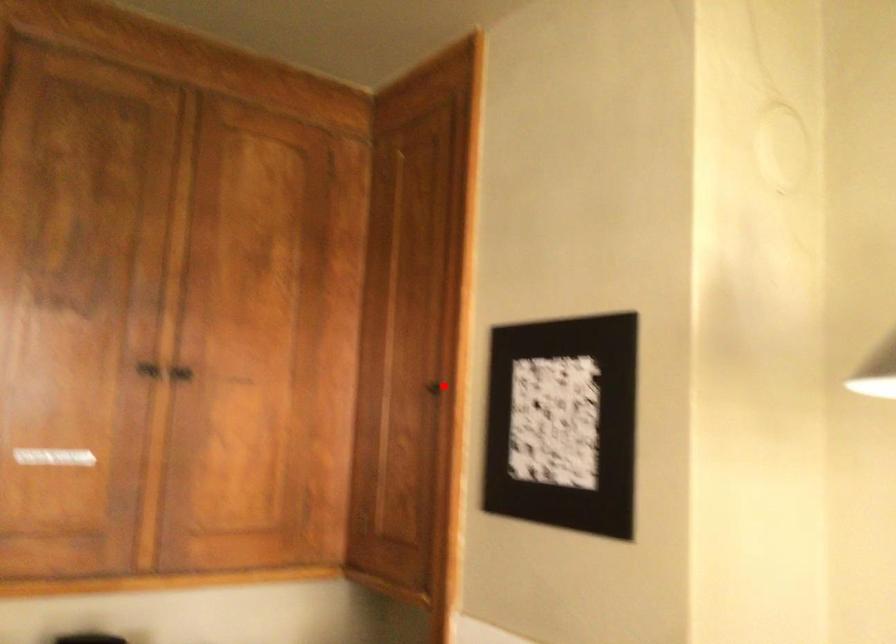
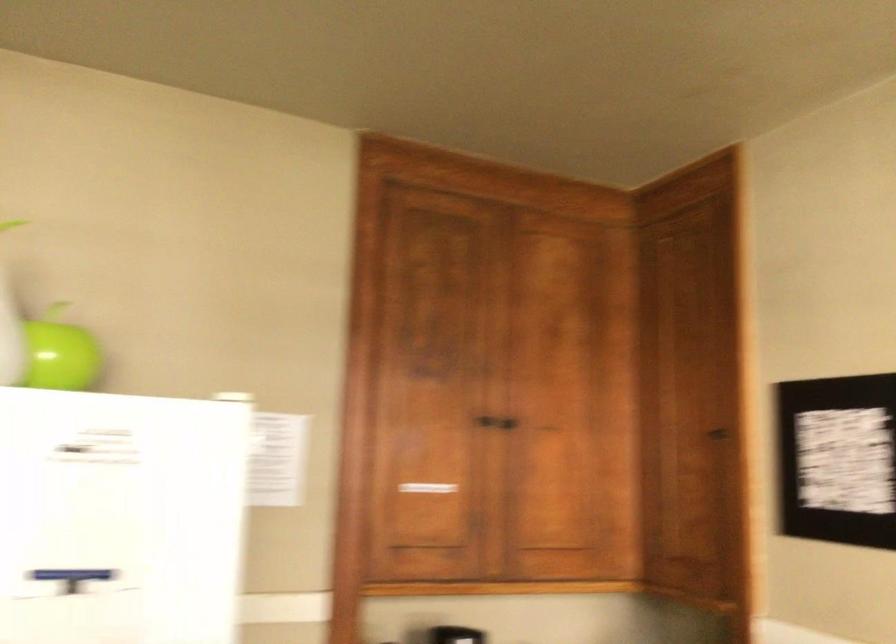
The point at the highlighted location is marked in the first image. Where is the corresponding point in the second image?

(719, 436)